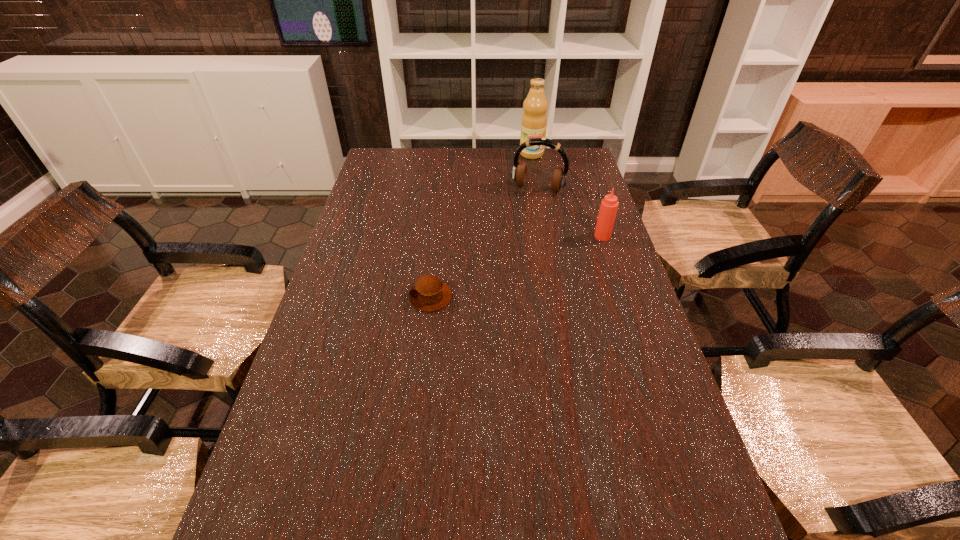
In the image, there is a desktop. In order to click on vacant space at the right edge in this screenshot , I will do `click(628, 458)`.

In the image, there is a desktop. Where is `vacant space at the far left corner`? This screenshot has width=960, height=540. vacant space at the far left corner is located at coordinates (414, 150).

Where is `vacant space that's between the third nearest object and the shortest object`? vacant space that's between the third nearest object and the shortest object is located at coordinates (484, 242).

Image resolution: width=960 pixels, height=540 pixels. What are the coordinates of `vacant space that is in between the nearest object and the tallest object` in the screenshot? It's located at (481, 226).

Identify the location of vacant point located between the second nearest object and the shortest object. The width and height of the screenshot is (960, 540). coord(516,267).

Locate an element on the screen. unoccupied position between the tallest object and the rightmost object is located at coordinates (567, 195).

Locate an element on the screen. free space between the olive oil and the nearest object is located at coordinates (481, 226).

The width and height of the screenshot is (960, 540). Identify the location of free space between the headset and the shortest object. (484, 242).

Locate an element on the screen. The width and height of the screenshot is (960, 540). vacant space that is in between the farthest object and the nearest object is located at coordinates (481, 226).

Where is `vacant space that's between the second farthest object and the muffin`? vacant space that's between the second farthest object and the muffin is located at coordinates (484, 242).